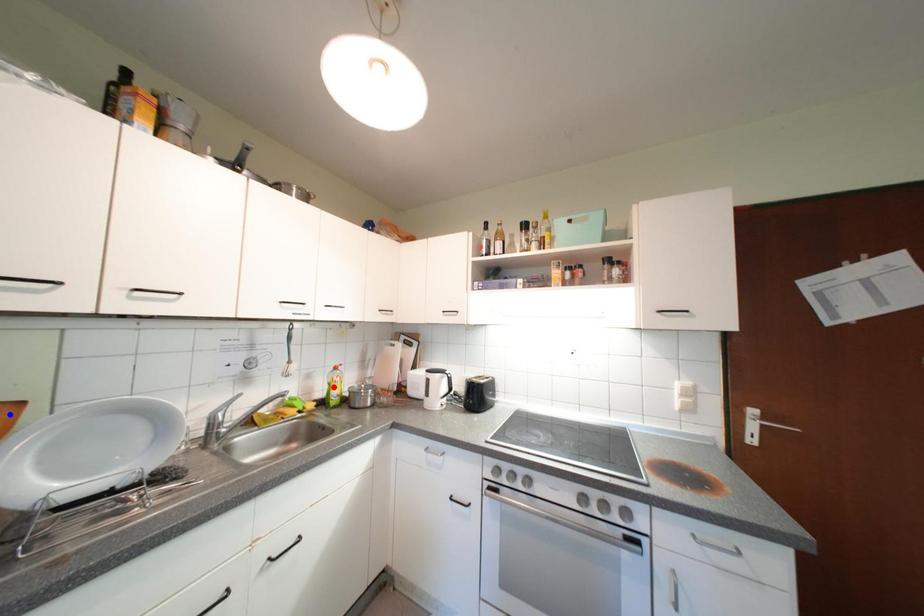
Question: In the image, two points are highlighted. Which point is nearer to the camera? Reply with the corresponding letter.

Choices:
 (A) blue point
 (B) red point

Answer: (A)